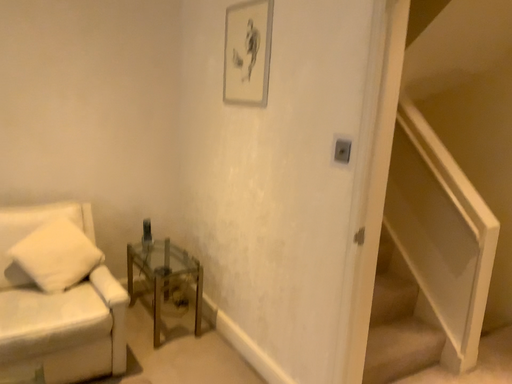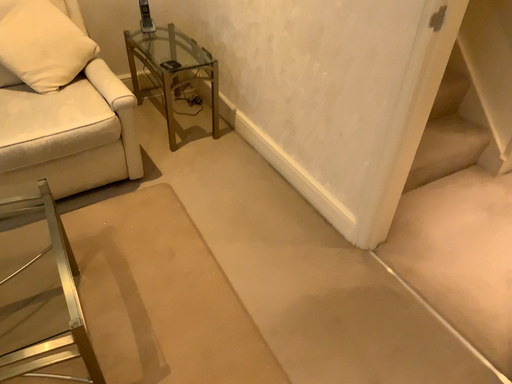
Question: How did the camera likely rotate when shooting the video?

Choices:
 (A) rotated downward
 (B) rotated upward

Answer: (A)